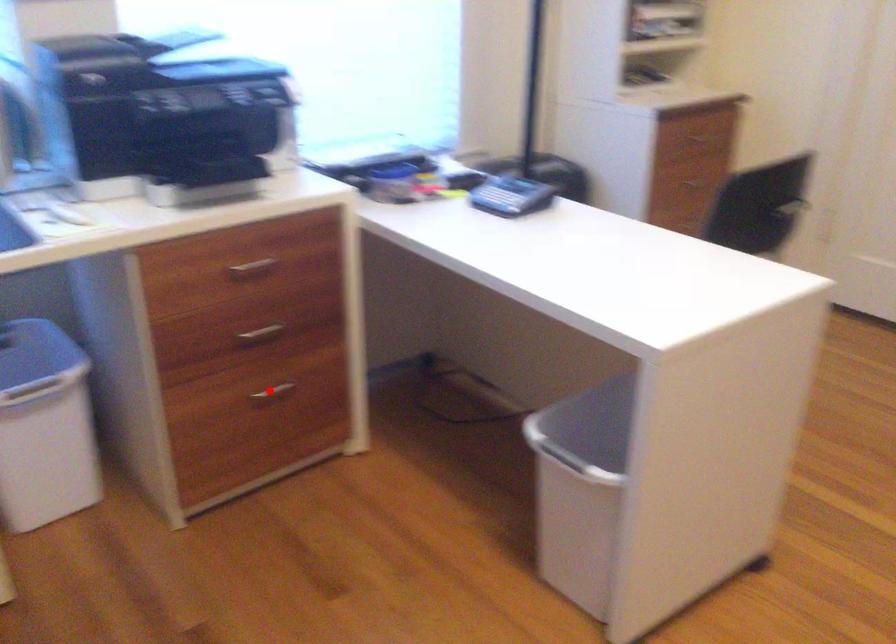
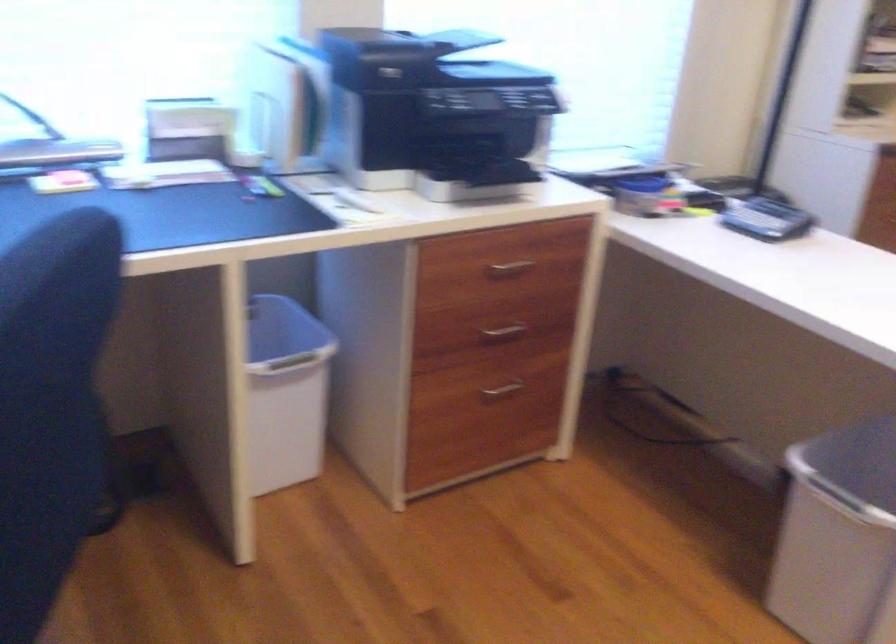
In the second image, find the point that corresponds to the highlighted location in the first image.

(501, 388)